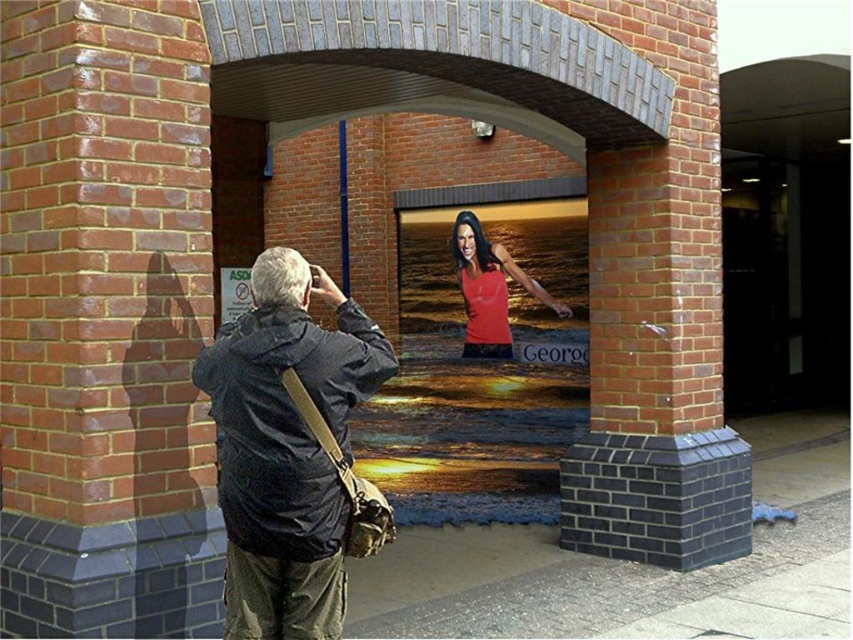
Who is taller, dark blue jacket at center or matte red tank top at center?

With more height is matte red tank top at center.

Does point (270, 474) lie behind point (553, 304)?

No.

Is point (318, 545) behind point (524, 276)?

No, it is in front of (524, 276).

The height and width of the screenshot is (640, 853). In order to click on dark blue jacket at center in this screenshot , I will do `click(286, 448)`.